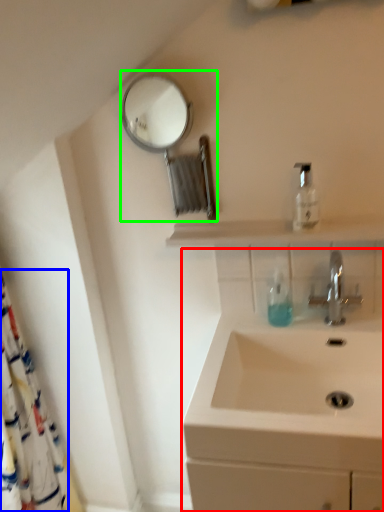
Question: Which object is the farthest from sink (highlighted by a red box)? Choose among these: shower curtain (highlighted by a blue box) or mirror (highlighted by a green box).

Choices:
 (A) shower curtain
 (B) mirror

Answer: (B)